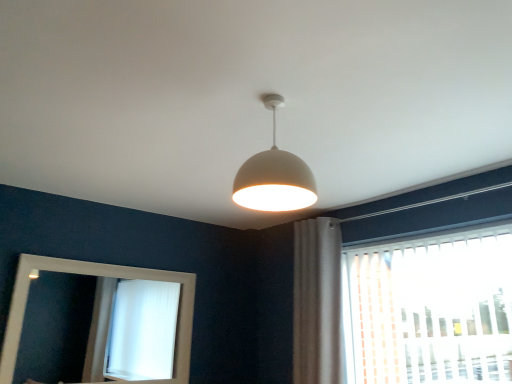
Question: Can we say white wooden mirror at lower left lies outside white matte/porcelain lampshade at center?

Choices:
 (A) yes
 (B) no

Answer: (A)

Question: Would you say white matte/porcelain lampshade at center is part of white wooden mirror at lower left's contents?

Choices:
 (A) no
 (B) yes

Answer: (A)

Question: Is white wooden mirror at lower left positioned with its back to white matte/porcelain lampshade at center?

Choices:
 (A) no
 (B) yes

Answer: (A)

Question: Is white wooden mirror at lower left not close to white matte/porcelain lampshade at center?

Choices:
 (A) no
 (B) yes

Answer: (B)

Question: Can you confirm if white wooden mirror at lower left is smaller than white matte/porcelain lampshade at center?

Choices:
 (A) yes
 (B) no

Answer: (B)

Question: Considering the relative positions of white fabric curtain at right and white plastic blinds at right in the image provided, is white fabric curtain at right to the left or to the right of white plastic blinds at right?

Choices:
 (A) left
 (B) right

Answer: (A)

Question: Relative to white plastic blinds at right, is white fabric curtain at right in front or behind?

Choices:
 (A) front
 (B) behind

Answer: (B)

Question: From the image's perspective, is white fabric curtain at right located above or below white plastic blinds at right?

Choices:
 (A) above
 (B) below

Answer: (B)

Question: Is white fabric curtain at right inside or outside of white plastic blinds at right?

Choices:
 (A) outside
 (B) inside

Answer: (A)

Question: Choose the correct answer: Is white fabric curtain at right inside white wooden mirror at lower left or outside it?

Choices:
 (A) inside
 (B) outside

Answer: (B)

Question: Based on their positions, is white fabric curtain at right located to the left or right of white wooden mirror at lower left?

Choices:
 (A) right
 (B) left

Answer: (A)

Question: Does point (329, 332) appear closer or farther from the camera than point (29, 344)?

Choices:
 (A) farther
 (B) closer

Answer: (B)

Question: In terms of width, does white fabric curtain at right look wider or thinner when compared to white wooden mirror at lower left?

Choices:
 (A) wide
 (B) thin

Answer: (A)

Question: Looking at the image, does white wooden mirror at lower left seem bigger or smaller compared to white fabric curtain at right?

Choices:
 (A) small
 (B) big

Answer: (A)

Question: Does point (88, 278) appear closer or farther from the camera than point (295, 299)?

Choices:
 (A) closer
 (B) farther

Answer: (B)